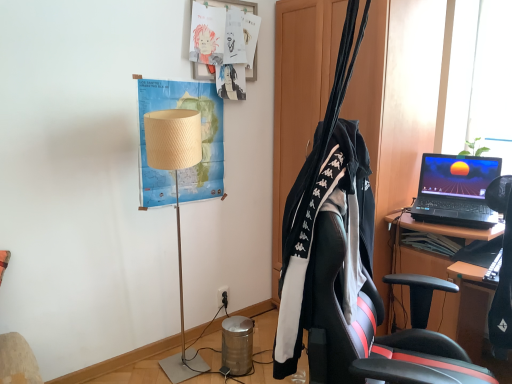
Question: From the image's perspective, would you say beige paper map at upper left, which ranks as the 2th poster in top-to-bottom order, is positioned over black plastic power outlet at lower center?

Choices:
 (A) yes
 (B) no

Answer: (A)

Question: Is beige paper map at upper left, which ranks as the 2th poster in top-to-bottom order, outside of black plastic power outlet at lower center?

Choices:
 (A) yes
 (B) no

Answer: (A)

Question: Is beige paper map at upper left, which ranks as the 2th poster in top-to-bottom order, closer to the viewer compared to black plastic power outlet at lower center?

Choices:
 (A) yes
 (B) no

Answer: (A)

Question: Is the position of beige paper map at upper left, which ranks as the 2th poster in top-to-bottom order, more distant than that of black plastic power outlet at lower center?

Choices:
 (A) yes
 (B) no

Answer: (B)

Question: Is beige paper map at upper left, the first poster in the bottom-to-top sequence, wider than black plastic power outlet at lower center?

Choices:
 (A) no
 (B) yes

Answer: (B)

Question: In the image, is beige fabric lampshade at center-left positioned in front of or behind beige paper map at upper left, the first poster in the bottom-to-top sequence?

Choices:
 (A) front
 (B) behind

Answer: (A)

Question: Considering the positions of beige fabric lampshade at center-left and beige paper map at upper left, the first poster in the bottom-to-top sequence, in the image, is beige fabric lampshade at center-left taller or shorter than beige paper map at upper left, the first poster in the bottom-to-top sequence,?

Choices:
 (A) short
 (B) tall

Answer: (B)

Question: In terms of size, does beige fabric lampshade at center-left appear bigger or smaller than beige paper map at upper left, which ranks as the 2th poster in top-to-bottom order?

Choices:
 (A) small
 (B) big

Answer: (B)

Question: From a real-world perspective, is beige fabric lampshade at center-left physically located above or below beige paper map at upper left, which ranks as the 2th poster in top-to-bottom order?

Choices:
 (A) below
 (B) above

Answer: (A)

Question: Is black fabric clothesline at center wider or thinner than matte paper posters at upper center, the second poster when ordered from bottom to top?

Choices:
 (A) thin
 (B) wide

Answer: (B)

Question: Choose the correct answer: Is black fabric clothesline at center inside matte paper posters at upper center, which is the 1th poster in top-to-bottom order, or outside it?

Choices:
 (A) inside
 (B) outside

Answer: (B)

Question: Would you say black fabric clothesline at center is to the left or to the right of matte paper posters at upper center, which is the 1th poster in top-to-bottom order, in the picture?

Choices:
 (A) left
 (B) right

Answer: (B)

Question: Based on their sizes in the image, would you say black fabric clothesline at center is bigger or smaller than matte paper posters at upper center, the second poster when ordered from bottom to top?

Choices:
 (A) small
 (B) big

Answer: (B)

Question: From the image's perspective, relative to beige paper map at upper left, the first poster in the bottom-to-top sequence, is matte paper posters at upper center, which is the 1th poster in top-to-bottom order, above or below?

Choices:
 (A) below
 (B) above

Answer: (B)

Question: Based on their sizes in the image, would you say matte paper posters at upper center, the second poster when ordered from bottom to top, is bigger or smaller than beige paper map at upper left, the first poster in the bottom-to-top sequence?

Choices:
 (A) small
 (B) big

Answer: (B)